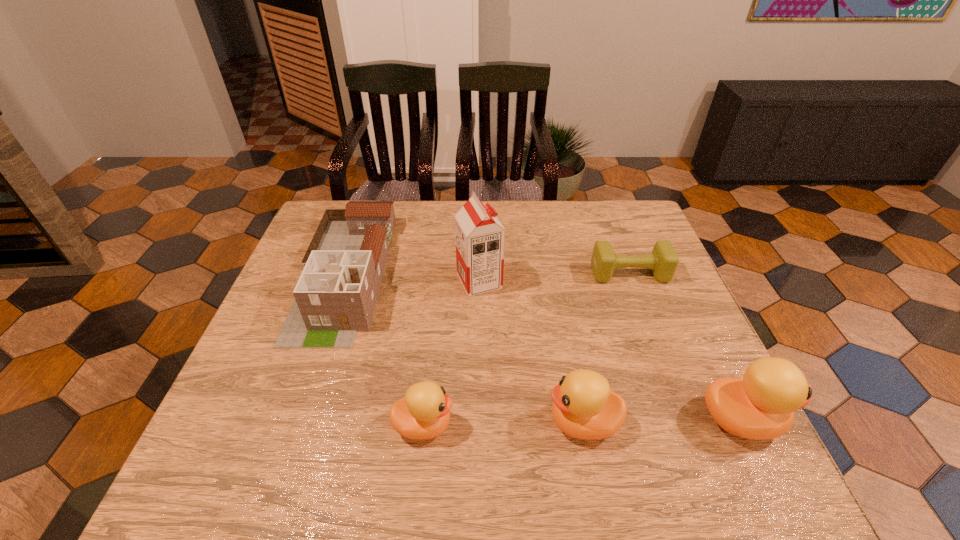
All ducklings are currently evenly spaced. To continue this pattern, where would you add another duckling on the left? Please point out a vacant spot. Please provide its 2D coordinates. Your answer should be formatted as a tuple, i.e. [(x, y)], where the tuple contains the x and y coordinates of a point satisfying the conditions above.

[(262, 428)]